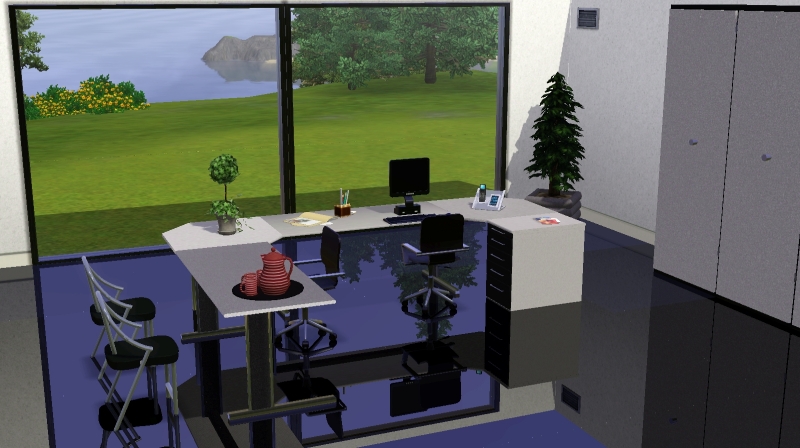
Find the location of `drawer`. drawer is located at coordinates (502, 237), (498, 250), (505, 267), (500, 279), (501, 300).